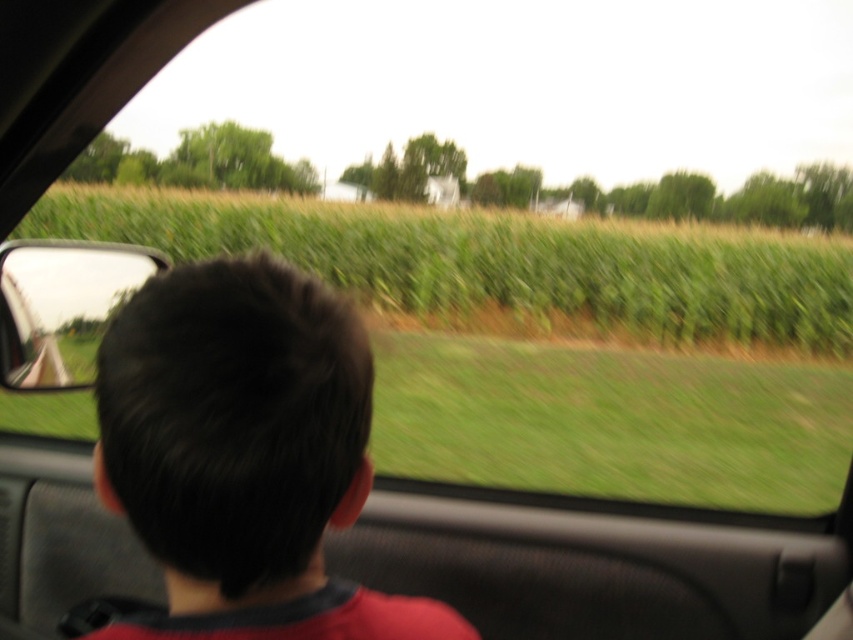
Question: Does dark brown hair at center appear under green grassy field at center?

Choices:
 (A) no
 (B) yes

Answer: (B)

Question: Which point is closer to the camera?

Choices:
 (A) dark brown hair at center
 (B) green grassy field at center

Answer: (A)

Question: Which point is farther to the camera?

Choices:
 (A) (254, 316)
 (B) (793, 273)

Answer: (B)

Question: Which of the following is the closest to the observer?

Choices:
 (A) green grassy field at center
 (B) dark brown hair at center

Answer: (B)

Question: Does dark brown hair at center appear under green grassy field at center?

Choices:
 (A) yes
 (B) no

Answer: (A)

Question: Does dark brown hair at center have a greater width compared to green grassy field at center?

Choices:
 (A) no
 (B) yes

Answer: (A)